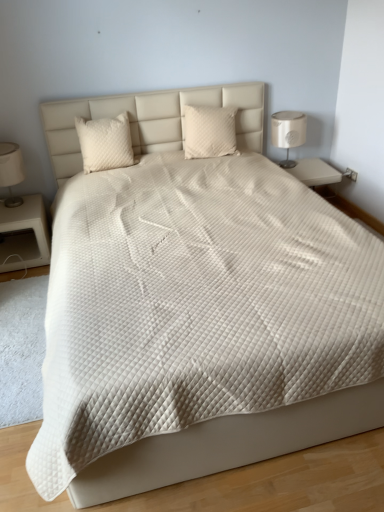
Question: From a real-world perspective, is white quilted pillow at upper left, the 2th pillow when ordered from right to left, above or below matte white lampshade at left, which appears as the first bedside lamp when viewed from the left?

Choices:
 (A) below
 (B) above

Answer: (B)

Question: Is white quilted pillow at upper left, the first pillow in the left-to-right sequence, bigger or smaller than matte white lampshade at left, which appears as the first bedside lamp when viewed from the left?

Choices:
 (A) big
 (B) small

Answer: (B)

Question: Estimate the real-world distances between objects in this image. Which object is closer to the white soft carpet at lower left?

Choices:
 (A) matte white lampshade at left, positioned as the 2th bedside lamp in right-to-left order
 (B) white matte nightstand at left
 (C) quilted beige pillow at center, arranged as the 2th pillow when viewed from the left
 (D) white quilted pillow at upper left, the 2th pillow when ordered from right to left
 (E) white fabric lampshade at right, marked as the 1th bedside lamp in a right-to-left arrangement

Answer: (B)

Question: Estimate the real-world distances between objects in this image. Which object is farther from the quilted beige pillow at center, arranged as the 2th pillow when viewed from the left?

Choices:
 (A) white soft carpet at lower left
 (B) white matte nightstand at left
 (C) white fabric lampshade at right, marked as the 1th bedside lamp in a right-to-left arrangement
 (D) white quilted pillow at upper left, the first pillow in the left-to-right sequence
 (E) matte white lampshade at left, which appears as the first bedside lamp when viewed from the left

Answer: (A)